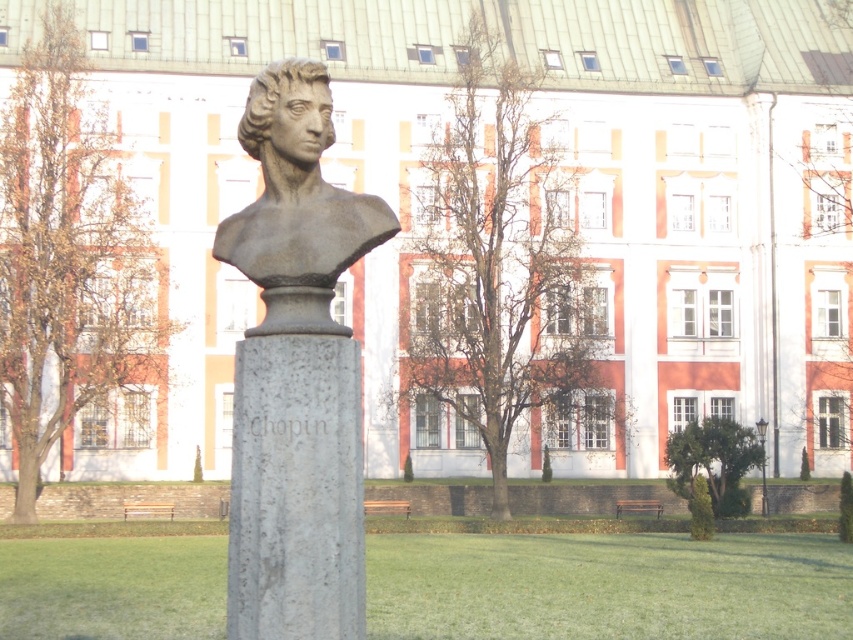
Question: Among these objects, which one is farthest from the camera?

Choices:
 (A) bronze statue at center
 (B) matte stone bust at center
 (C) gray stone bust at center

Answer: (B)

Question: Which object is the farthest from the gray stone bust at center?

Choices:
 (A) gray stone column at center
 (B) bronze statue at center
 (C) matte stone bust at center

Answer: (C)

Question: Is gray stone bust at center in front of bronze statue at center?

Choices:
 (A) yes
 (B) no

Answer: (A)

Question: Considering the relative positions of gray stone bust at center and gray stone column at center in the image provided, where is gray stone bust at center located with respect to gray stone column at center?

Choices:
 (A) above
 (B) below

Answer: (A)

Question: Among these objects, which one is nearest to the camera?

Choices:
 (A) matte stone bust at center
 (B) gray stone bust at center
 (C) gray stone column at center

Answer: (C)

Question: Does gray stone bust at center appear under bronze statue at center?

Choices:
 (A) yes
 (B) no

Answer: (A)